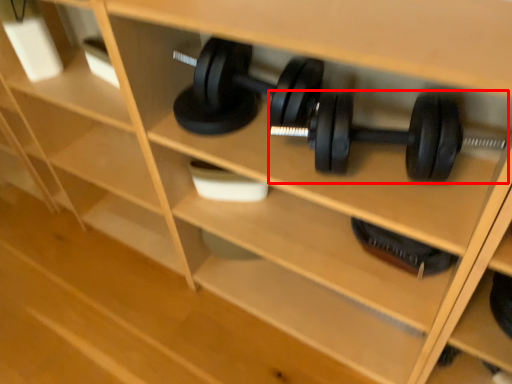
Question: Considering the relative positions of dumbbell (annotated by the red box) and dumbbell in the image provided, where is dumbbell (annotated by the red box) located with respect to the staircase?

Choices:
 (A) left
 (B) right

Answer: (A)